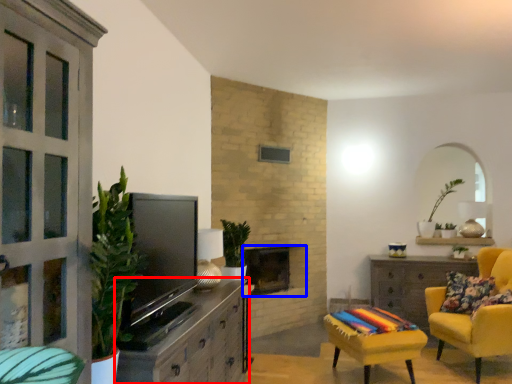
Question: Which object appears closest to the camera in this image, cabinetry (highlighted by a red box) or fireplace (highlighted by a blue box)?

Choices:
 (A) cabinetry
 (B) fireplace

Answer: (A)